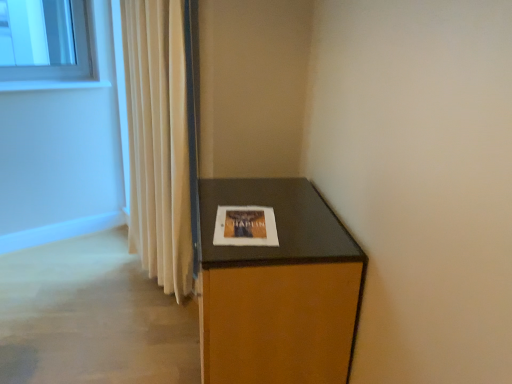
Question: Is matte white picture frame at center not near brown wood cabinet at lower right?

Choices:
 (A) yes
 (B) no

Answer: (B)

Question: Does matte white picture frame at center have a lesser height compared to brown wood cabinet at lower right?

Choices:
 (A) yes
 (B) no

Answer: (A)

Question: From the image's perspective, is matte white picture frame at center under brown wood cabinet at lower right?

Choices:
 (A) no
 (B) yes

Answer: (A)

Question: Does matte white picture frame at center come behind brown wood cabinet at lower right?

Choices:
 (A) yes
 (B) no

Answer: (A)

Question: Considering the relative positions of matte white picture frame at center and brown wood cabinet at lower right in the image provided, is matte white picture frame at center in front of brown wood cabinet at lower right?

Choices:
 (A) yes
 (B) no

Answer: (B)

Question: From a real-world perspective, is matte white picture frame at center located higher than brown wood cabinet at lower right?

Choices:
 (A) no
 (B) yes

Answer: (B)

Question: Is beige fabric curtain at left with matte white picture frame at center?

Choices:
 (A) yes
 (B) no

Answer: (B)

Question: Considering the relative sizes of beige fabric curtain at left and matte white picture frame at center in the image provided, is beige fabric curtain at left bigger than matte white picture frame at center?

Choices:
 (A) yes
 (B) no

Answer: (A)

Question: Is beige fabric curtain at left facing towards matte white picture frame at center?

Choices:
 (A) no
 (B) yes

Answer: (A)

Question: From a real-world perspective, is beige fabric curtain at left located beneath matte white picture frame at center?

Choices:
 (A) no
 (B) yes

Answer: (B)

Question: Is beige fabric curtain at left further to the viewer compared to matte white picture frame at center?

Choices:
 (A) yes
 (B) no

Answer: (A)

Question: Is beige fabric curtain at left closer to camera compared to matte white picture frame at center?

Choices:
 (A) no
 (B) yes

Answer: (A)

Question: Does white glossy window sill at upper left appear on the right side of beige fabric curtain at left?

Choices:
 (A) no
 (B) yes

Answer: (A)